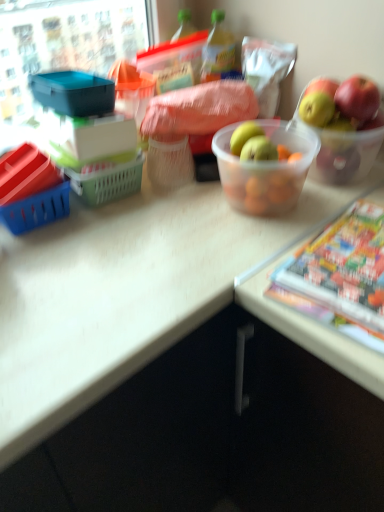
Where is `free spot above multicolored glossy comic book at lower right (from a real-world perspective)`? This screenshot has width=384, height=512. free spot above multicolored glossy comic book at lower right (from a real-world perspective) is located at coordinates (348, 260).